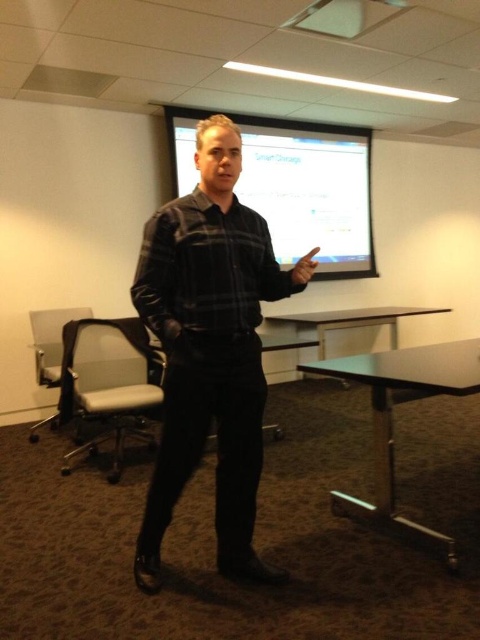
You are a guest attending a meeting and need to sit down. There is a gray fabric swivel chair at left and a white glossy table at lower center. Which object should you approach to find a seat?

You should approach the gray fabric swivel chair at left to find a seat because it is positioned under the white glossy table at lower center, indicating it is the chair for that table.

You are a presenter who needs to adjust the focus of the white glossy projection screen at upper center. You are currently sitting in the gray fabric swivel chair at left. Can you reach the screen without leaving your seat?

The white glossy projection screen at upper center is 2.45 meters away from the gray fabric swivel chair at left. Since the distance is too far to reach while sitting, you will need to get up to adjust the focus.

You are a photographer setting up for a group photo in the conference room. You need to ensure that the black plaid shirt at center and the black metal table at lower center are both in the frame. Considering their sizes, which object should you focus on to ensure both are properly captured?

The black plaid shirt at center is much taller than the black metal table at lower center, so focusing on the black plaid shirt at center will ensure both are properly captured as it is the taller object.